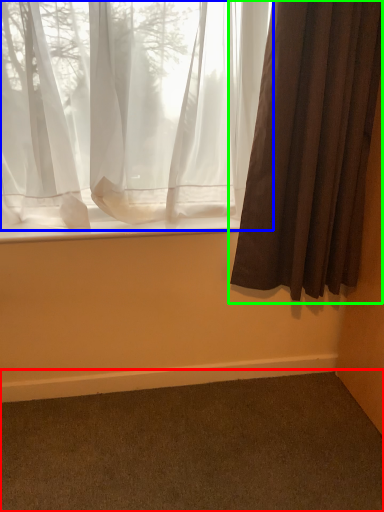
Question: Considering the real-world distances, which object is closest to plain (highlighted by a red box)? curtain (highlighted by a blue box) or curtain (highlighted by a green box).

Choices:
 (A) curtain
 (B) curtain

Answer: (B)